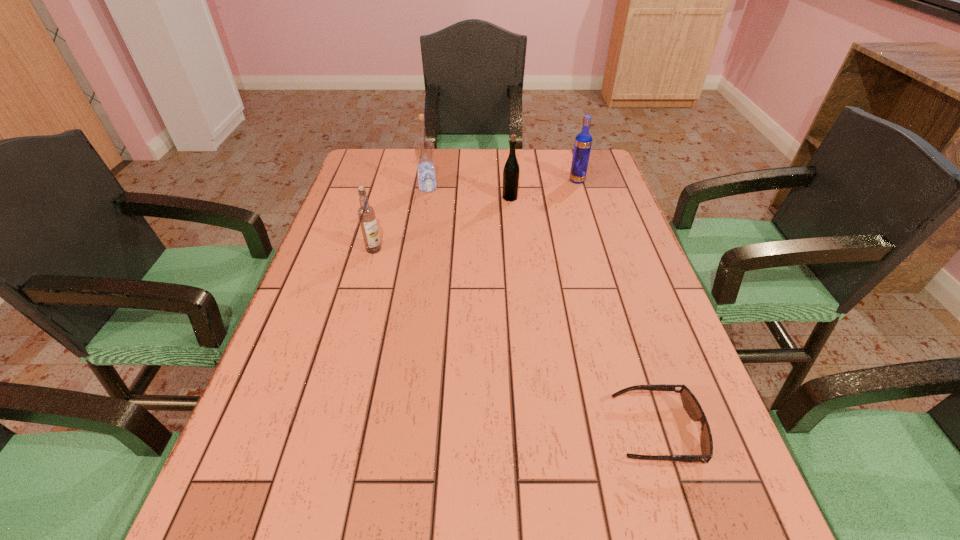
The width and height of the screenshot is (960, 540). Find the location of `vacant space at the left edge of the desktop`. vacant space at the left edge of the desktop is located at coordinates (276, 478).

Image resolution: width=960 pixels, height=540 pixels. I want to click on free space at the right edge of the desktop, so click(594, 195).

You are a GUI agent. You are given a task and a screenshot of the screen. Output one action in this format:
    pyautogui.click(x=<x>, y=<y>)
    Task: Click on the free space at the far left corner of the desktop
    Image resolution: width=960 pixels, height=540 pixels.
    Given the screenshot: What is the action you would take?
    pyautogui.click(x=380, y=157)

The height and width of the screenshot is (540, 960). I want to click on vacant space in between the second nearest object and the sunglasses, so click(x=516, y=340).

What are the coordinates of `free area in between the shortest object and the rightmost vodka` in the screenshot? It's located at (616, 306).

This screenshot has height=540, width=960. Find the location of `vacant area between the second vodka from right to left and the rightmost vodka`. vacant area between the second vodka from right to left and the rightmost vodka is located at coordinates (502, 184).

Where is `vacant region between the rightmost vodka and the shortest object`? Image resolution: width=960 pixels, height=540 pixels. vacant region between the rightmost vodka and the shortest object is located at coordinates (616, 306).

The width and height of the screenshot is (960, 540). I want to click on free space between the third nearest object and the shortest object, so click(584, 314).

This screenshot has height=540, width=960. I want to click on vacant region between the rightmost vodka and the second vodka from left to right, so (502, 184).

The image size is (960, 540). I want to click on vacant area that lies between the fourth object from right to left and the rightmost vodka, so click(502, 184).